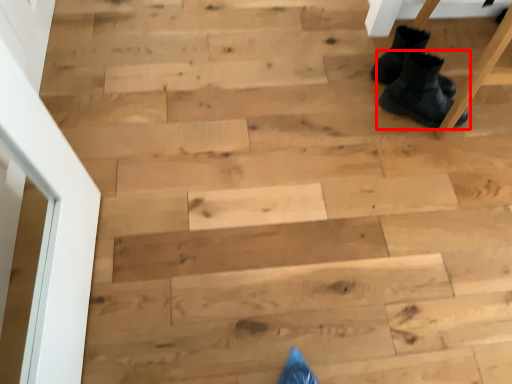
Question: From the image's perspective, where is footwear (annotated by the red box) located in relation to footwear in the image?

Choices:
 (A) below
 (B) above

Answer: (A)